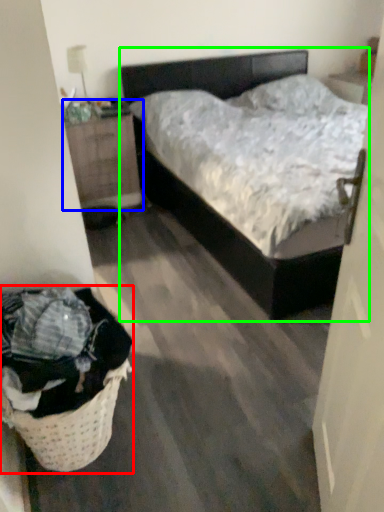
Question: Which object is positioned farthest from laundry basket (highlighted by a red box)? Select from nightstand (highlighted by a blue box) and bed (highlighted by a green box).

Choices:
 (A) nightstand
 (B) bed

Answer: (A)